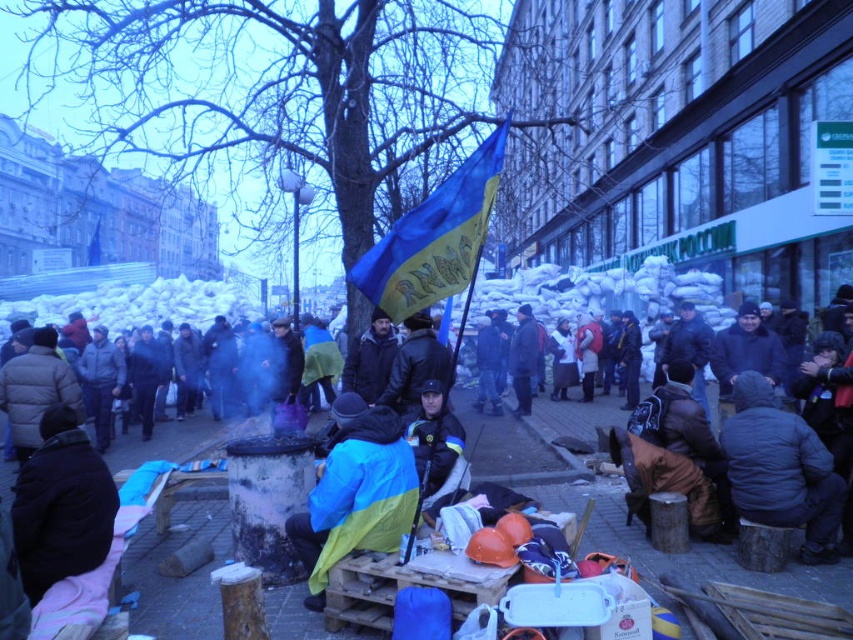
Question: Can you confirm if dark gray puffy jacket at lower right is positioned to the right of blue/yellow fabric flag at center?

Choices:
 (A) yes
 (B) no

Answer: (A)

Question: Does blue/yellow fabric jacket at center have a smaller size compared to black matte jacket at lower left?

Choices:
 (A) yes
 (B) no

Answer: (B)

Question: Which is farther from the blue/yellow flag at center?

Choices:
 (A) blue/yellow fabric jacket at center
 (B) dark gray puffy jacket at lower right
 (C) black matte jacket at lower left
 (D) blue/yellow fabric flag at center

Answer: (D)

Question: Is blue/yellow flag at center bigger than black matte jacket at lower left?

Choices:
 (A) yes
 (B) no

Answer: (A)

Question: Based on their relative distances, which object is farther from the blue/yellow flag at center?

Choices:
 (A) blue/yellow fabric jacket at center
 (B) dark gray puffy jacket at lower right

Answer: (B)

Question: Which point is closer to the camera taking this photo?

Choices:
 (A) (466, 262)
 (B) (770, 500)

Answer: (A)